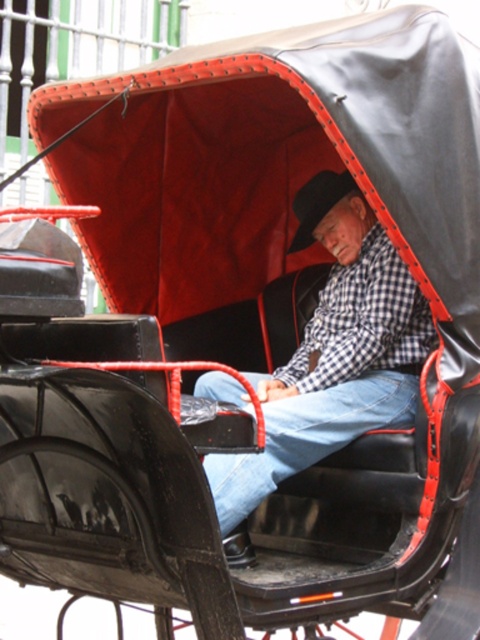
Question: Which point is closer to the camera?

Choices:
 (A) checkered fabric shirt at center
 (B) blue denim jeans at center

Answer: (A)

Question: Can you confirm if checkered fabric shirt at center is positioned below blue denim jeans at center?

Choices:
 (A) yes
 (B) no

Answer: (B)

Question: Which object is closer to the camera taking this photo?

Choices:
 (A) checkered fabric shirt at center
 (B) blue denim jeans at center

Answer: (A)

Question: Which object is closer to the camera taking this photo?

Choices:
 (A) blue denim jeans at center
 (B) checkered fabric shirt at center

Answer: (B)

Question: Does checkered fabric shirt at center have a lesser width compared to blue denim jeans at center?

Choices:
 (A) no
 (B) yes

Answer: (A)

Question: Is checkered fabric shirt at center above blue denim jeans at center?

Choices:
 (A) yes
 (B) no

Answer: (A)